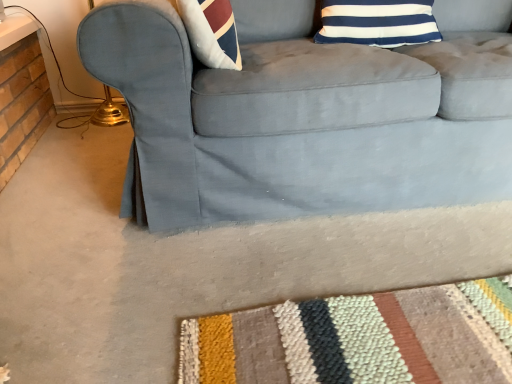
Question: Is suede couch at center oriented towards blue/white striped pillow at upper right?

Choices:
 (A) no
 (B) yes

Answer: (B)

Question: Considering the relative positions of suede couch at center and blue/white striped pillow at upper right in the image provided, is suede couch at center behind blue/white striped pillow at upper right?

Choices:
 (A) yes
 (B) no

Answer: (B)

Question: From a real-world perspective, is suede couch at center located higher than blue/white striped pillow at upper right?

Choices:
 (A) no
 (B) yes

Answer: (A)

Question: Can you confirm if suede couch at center is taller than blue/white striped pillow at upper right?

Choices:
 (A) no
 (B) yes

Answer: (B)

Question: Is suede couch at center wider than blue/white striped pillow at upper right?

Choices:
 (A) no
 (B) yes

Answer: (B)

Question: Is the depth of suede couch at center less than that of blue/white striped pillow at upper right?

Choices:
 (A) no
 (B) yes

Answer: (B)

Question: Is suede couch at center inside blue/white striped pillow at upper right?

Choices:
 (A) no
 (B) yes

Answer: (A)

Question: Considering the relative sizes of blue/white striped pillow at upper right and suede couch at center in the image provided, is blue/white striped pillow at upper right taller than suede couch at center?

Choices:
 (A) yes
 (B) no

Answer: (B)

Question: Does blue/white striped pillow at upper right have a larger size compared to suede couch at center?

Choices:
 (A) yes
 (B) no

Answer: (B)

Question: From the image's perspective, is blue/white striped pillow at upper right below suede couch at center?

Choices:
 (A) yes
 (B) no

Answer: (B)

Question: From the image's perspective, is blue/white striped pillow at upper right on top of suede couch at center?

Choices:
 (A) no
 (B) yes

Answer: (B)

Question: From a real-world perspective, does blue/white striped pillow at upper right sit lower than suede couch at center?

Choices:
 (A) no
 (B) yes

Answer: (A)

Question: Visually, is suede couch at center positioned to the left or to the right of blue/white striped pillow at upper right?

Choices:
 (A) left
 (B) right

Answer: (B)